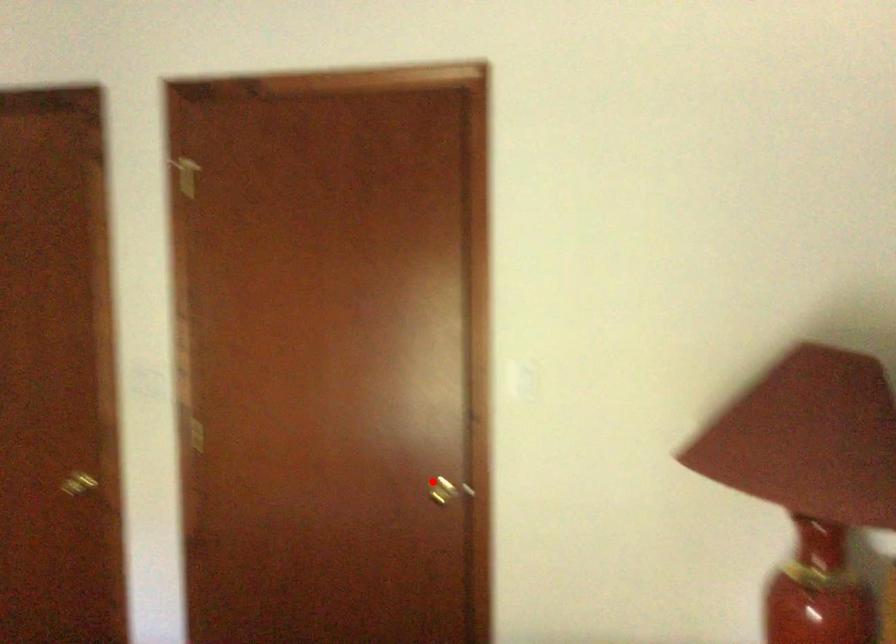
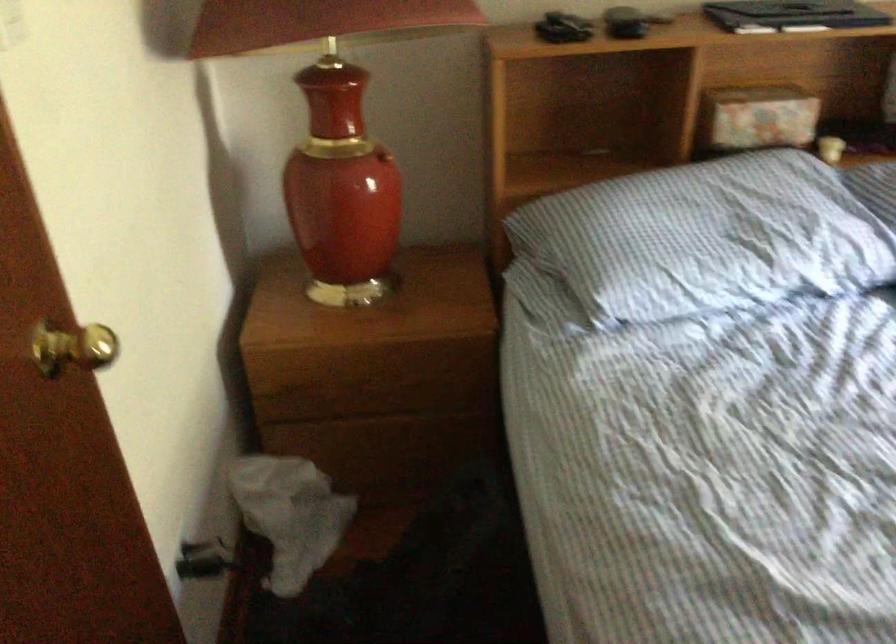
Question: I am providing you with two images of the same scene from different viewpoints. In image1, a red point is highlighted. Considering the same 3D point in image2, which of the following is correct?

Choices:
 (A) It is closer
 (B) It is farther

Answer: (A)